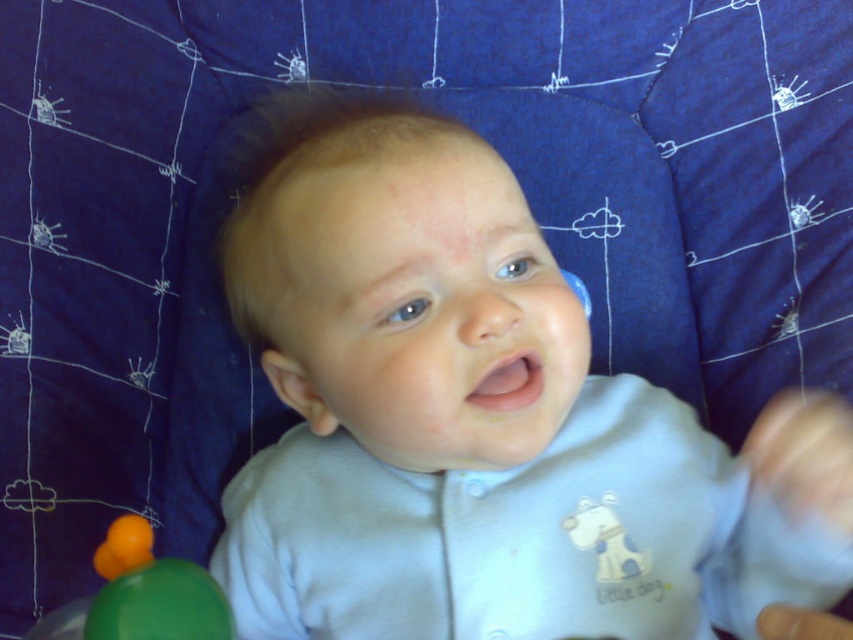
Looking at this image, can you confirm if light blue fabric baby at center is smaller than green rubber ball at lower left?

Incorrect, light blue fabric baby at center is not smaller in size than green rubber ball at lower left.

What do you see at coordinates (482, 419) in the screenshot?
I see `light blue fabric baby at center` at bounding box center [482, 419].

Is point (534, 250) farther from camera compared to point (109, 627)?

Yes, point (534, 250) is behind point (109, 627).

Image resolution: width=853 pixels, height=640 pixels. Identify the location of light blue fabric baby at center. (482, 419).